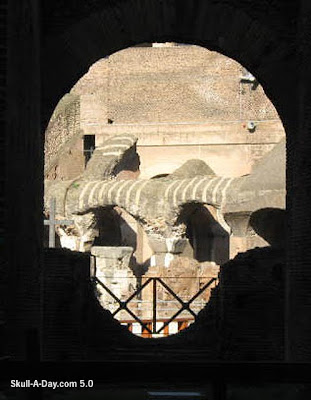
Identify the location of tan wall. This screenshot has width=311, height=400. (167, 90).